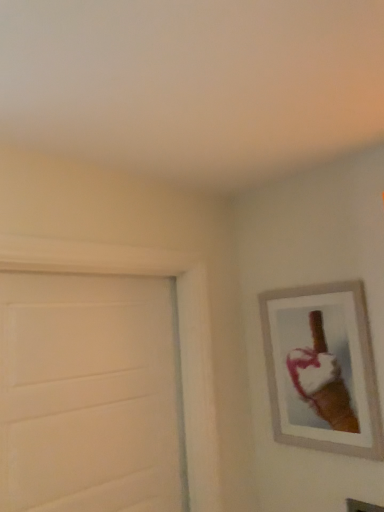
You are a GUI agent. You are given a task and a screenshot of the screen. Output one action in this format:
    pyautogui.click(x=<x>, y=<y>)
    Task: Click on the white matte door at left
    The height and width of the screenshot is (512, 384).
    Given the screenshot: What is the action you would take?
    pyautogui.click(x=90, y=394)

The width and height of the screenshot is (384, 512). What do you see at coordinates (90, 394) in the screenshot?
I see `white matte door at left` at bounding box center [90, 394].

Image resolution: width=384 pixels, height=512 pixels. What do you see at coordinates (322, 369) in the screenshot?
I see `wooden picture frame at upper right` at bounding box center [322, 369].

Identify the location of wooden picture frame at upper right. Image resolution: width=384 pixels, height=512 pixels. (322, 369).

What are the coordinates of `white matte door at left` in the screenshot? It's located at (90, 394).

Based on their positions, is wooden picture frame at upper right located to the left or right of white matte door at left?

wooden picture frame at upper right is positioned on white matte door at left's right side.

From the picture: Which object is further away from the camera taking this photo, wooden picture frame at upper right or white matte door at left?

Positioned behind is wooden picture frame at upper right.

Considering the positions of points (308, 368) and (93, 296), is point (308, 368) farther from camera compared to point (93, 296)?

Yes, point (308, 368) is behind point (93, 296).

Based on the photo, from the image's perspective, which one is positioned lower, wooden picture frame at upper right or white matte door at left?

white matte door at left, from the image's perspective.

From a real-world perspective, is wooden picture frame at upper right positioned over white matte door at left based on gravity?

Correct, in the physical world, wooden picture frame at upper right is higher than white matte door at left.

Looking at this image, can you confirm if wooden picture frame at upper right is thinner than white matte door at left?

Indeed, wooden picture frame at upper right has a lesser width compared to white matte door at left.

Can you confirm if wooden picture frame at upper right is taller than white matte door at left?

No.

Considering the sizes of objects wooden picture frame at upper right and white matte door at left in the image provided, who is bigger, wooden picture frame at upper right or white matte door at left?

white matte door at left.

Choose the correct answer: Is wooden picture frame at upper right inside white matte door at left or outside it?

wooden picture frame at upper right is outside white matte door at left.

Would you consider wooden picture frame at upper right to be distant from white matte door at left?

No.

Is wooden picture frame at upper right aimed at white matte door at left?

Yes, wooden picture frame at upper right faces towards white matte door at left.

Locate an element on the screen. This screenshot has width=384, height=512. picture frame that is above the white matte door at left (from a real-world perspective) is located at coordinates (322, 369).

Which object is positioned more to the right, white matte door at left or wooden picture frame at upper right?

From the viewer's perspective, wooden picture frame at upper right appears more on the right side.

Who is more distant, white matte door at left or wooden picture frame at upper right?

wooden picture frame at upper right is behind.

Which is less distant, (x=38, y=283) or (x=359, y=442)?

Point (x=38, y=283).

From the image's perspective, is white matte door at left above wooden picture frame at upper right?

Actually, white matte door at left appears below wooden picture frame at upper right in the image.

From a real-world perspective, is white matte door at left physically above wooden picture frame at upper right?

No.

Between white matte door at left and wooden picture frame at upper right, which one has larger width?

white matte door at left is wider.

Between white matte door at left and wooden picture frame at upper right, which one has less height?

wooden picture frame at upper right.

Considering the relative sizes of white matte door at left and wooden picture frame at upper right in the image provided, is white matte door at left smaller than wooden picture frame at upper right?

No, white matte door at left is not smaller than wooden picture frame at upper right.

Would you say wooden picture frame at upper right is part of white matte door at left's contents?

No, wooden picture frame at upper right is not a part of white matte door at left.

Is white matte door at left touching wooden picture frame at upper right?

No, white matte door at left is not with wooden picture frame at upper right.

Is white matte door at left turned away from wooden picture frame at upper right?

No, white matte door at left is not facing away from wooden picture frame at upper right.

Consider the image. Measure the distance from white matte door at left to wooden picture frame at upper right.

white matte door at left is 65.22 centimeters away from wooden picture frame at upper right.

Locate an element on the screen. This screenshot has width=384, height=512. picture frame above the white matte door at left (from the image's perspective) is located at coordinates (322, 369).

In order to click on picture frame that is above the white matte door at left (from a real-world perspective) in this screenshot , I will do `click(322, 369)`.

You are a GUI agent. You are given a task and a screenshot of the screen. Output one action in this format:
    pyautogui.click(x=<x>, y=<y>)
    Task: Click on the door on the left side of wooden picture frame at upper right
    This screenshot has width=384, height=512.
    Given the screenshot: What is the action you would take?
    pyautogui.click(x=90, y=394)